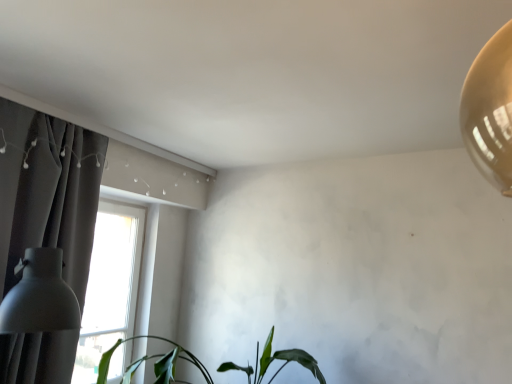
Question: Considering the relative sizes of green matte plant at lower center and dark gray fabric curtain at left in the image provided, is green matte plant at lower center wider than dark gray fabric curtain at left?

Choices:
 (A) no
 (B) yes

Answer: (B)

Question: Can you confirm if green matte plant at lower center is taller than dark gray fabric curtain at left?

Choices:
 (A) yes
 (B) no

Answer: (B)

Question: Does green matte plant at lower center appear on the left side of dark gray fabric curtain at left?

Choices:
 (A) no
 (B) yes

Answer: (A)

Question: Can you confirm if green matte plant at lower center is shorter than dark gray fabric curtain at left?

Choices:
 (A) no
 (B) yes

Answer: (B)

Question: From a real-world perspective, is green matte plant at lower center beneath dark gray fabric curtain at left?

Choices:
 (A) yes
 (B) no

Answer: (A)

Question: Could you tell me if green matte plant at lower center is facing dark gray fabric curtain at left?

Choices:
 (A) no
 (B) yes

Answer: (A)

Question: Is the surface of dark gray fabric curtain at left in direct contact with green matte plant at lower center?

Choices:
 (A) no
 (B) yes

Answer: (A)

Question: Is green matte plant at lower center inside dark gray fabric curtain at left?

Choices:
 (A) yes
 (B) no

Answer: (B)

Question: Is dark gray fabric curtain at left taller than green matte plant at lower center?

Choices:
 (A) no
 (B) yes

Answer: (B)

Question: Can you confirm if dark gray fabric curtain at left is wider than green matte plant at lower center?

Choices:
 (A) no
 (B) yes

Answer: (A)

Question: Is dark gray fabric curtain at left positioned with its back to green matte plant at lower center?

Choices:
 (A) yes
 (B) no

Answer: (B)

Question: Considering the relative positions of dark gray fabric curtain at left and green matte plant at lower center in the image provided, is dark gray fabric curtain at left to the right of green matte plant at lower center from the viewer's perspective?

Choices:
 (A) yes
 (B) no

Answer: (B)

Question: Does dark gray fabric curtain at left have a greater height compared to matte white lampshade at left?

Choices:
 (A) no
 (B) yes

Answer: (B)